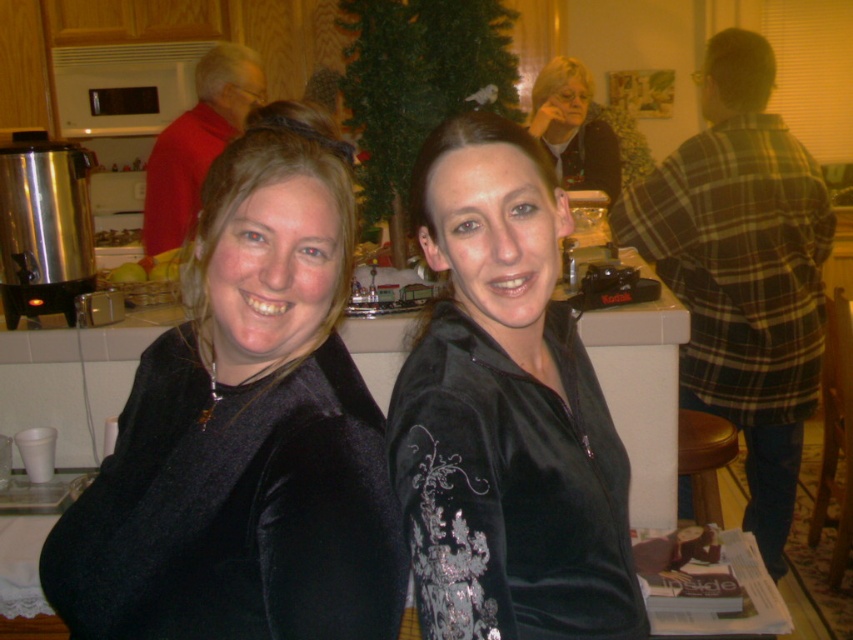
Where is the velvet black jacket at left located in the image?

The velvet black jacket at left is located at point 0.672 on the x axis and 0.288 on the y axis.

You are planning to place a rectangular box that is 1 meter wide on the countertop. The velvet black jacket at left and brown leather stool at lower right are in the way. Which object do you need to move to make space for the box?

You need to move the velvet black jacket at left because its width is greater than the brown leather stool at lower right, so removing it would create more space for the 1 meter wide box.

You are organizing a clothing display and need to place the velvet black jacket at left and the velvet black jacket at center on a shelf. If the shelf can only hold items up to the width of the narrower jacket, will both jackets fit?

The velvet black jacket at left is wider than the velvet black jacket at center. Since the shelf can only hold items up to the width of the narrower jacket, the velvet black jacket at left will not fit, but the velvet black jacket at center will.